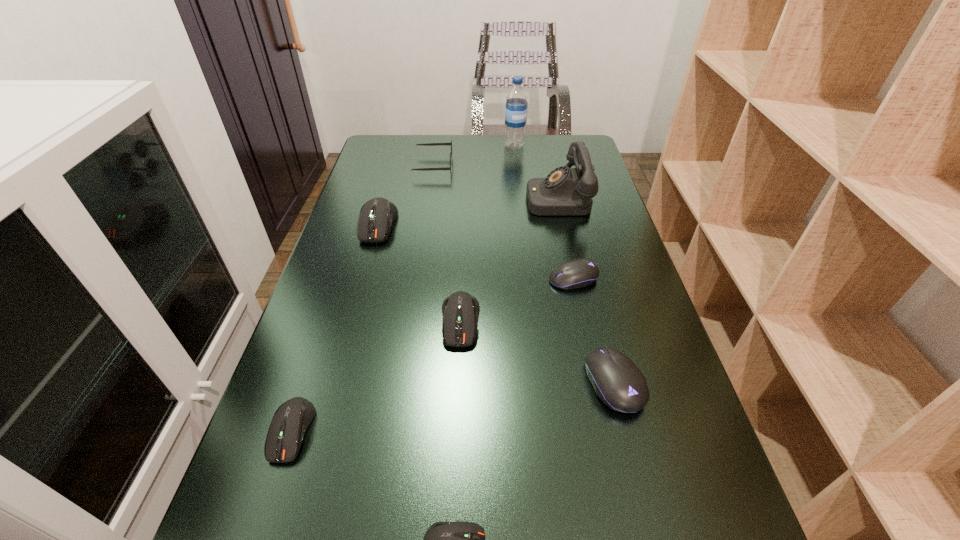
Find the location of a particular element. The height and width of the screenshot is (540, 960). the nearer black computer mouse is located at coordinates (617, 381).

Locate an element on the screen. This screenshot has width=960, height=540. the second nearest dark computer equipment is located at coordinates (291, 420).

You are a GUI agent. You are given a task and a screenshot of the screen. Output one action in this format:
    pyautogui.click(x=<x>, y=<y>)
    Task: Click on the fifth nearest object
    
    Given the screenshot: What is the action you would take?
    pyautogui.click(x=578, y=273)

Image resolution: width=960 pixels, height=540 pixels. Identify the location of the smaller black computer mouse. (x=578, y=273).

The height and width of the screenshot is (540, 960). What are the coordinates of `vacant space located on the label of the blue water bottle` in the screenshot? It's located at [x=516, y=162].

I want to click on free spot located on the dial of the eighth shortest object, so click(x=499, y=198).

The height and width of the screenshot is (540, 960). I want to click on free space located 0.120m on the dial of the eighth shortest object, so click(486, 198).

This screenshot has width=960, height=540. Find the location of `vacant area situated 0.310m on the dial of the eighth shortest object`. vacant area situated 0.310m on the dial of the eighth shortest object is located at coordinates (421, 198).

Where is `vacant space located 0.350m on the front-facing side of the third object from left to right`? This screenshot has height=540, width=960. vacant space located 0.350m on the front-facing side of the third object from left to right is located at coordinates (559, 165).

You are a GUI agent. You are given a task and a screenshot of the screen. Output one action in this format:
    pyautogui.click(x=<x>, y=<y>)
    Task: Click on the free space located on the button of the tallest computer equipment
    This screenshot has height=540, width=960.
    Given the screenshot: What is the action you would take?
    pyautogui.click(x=360, y=286)